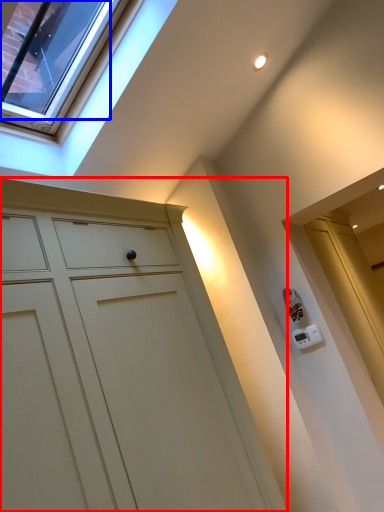
Question: Among these objects, which one is nearest to the camera, cupboard (highlighted by a red box) or glass door (highlighted by a blue box)?

Choices:
 (A) cupboard
 (B) glass door

Answer: (A)